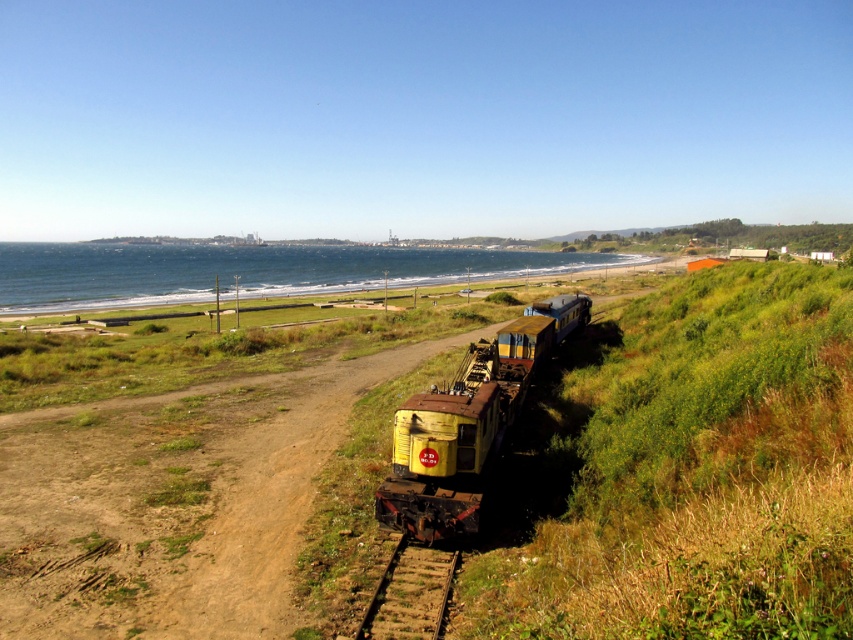
Question: Can you confirm if green grassy at lower right is positioned above rusty yellow train at center-right?

Choices:
 (A) yes
 (B) no

Answer: (A)

Question: Which object is farther from the camera taking this photo?

Choices:
 (A) rusty yellow train at center-right
 (B) green grassy at lower right

Answer: (A)

Question: Which point is closer to the camera?

Choices:
 (A) brown dirt train track at center
 (B) green grassy at lower right
 (C) rusty yellow train at center-right

Answer: (B)

Question: Is green grassy at lower right to the left of rusty yellow train at center-right from the viewer's perspective?

Choices:
 (A) no
 (B) yes

Answer: (A)

Question: Which object is farther from the camera taking this photo?

Choices:
 (A) brown dirt train track at center
 (B) green grassy at lower right
 (C) rusty yellow train at center-right

Answer: (C)

Question: Is green grassy at lower right to the left of rusty yellow train at center-right from the viewer's perspective?

Choices:
 (A) yes
 (B) no

Answer: (B)